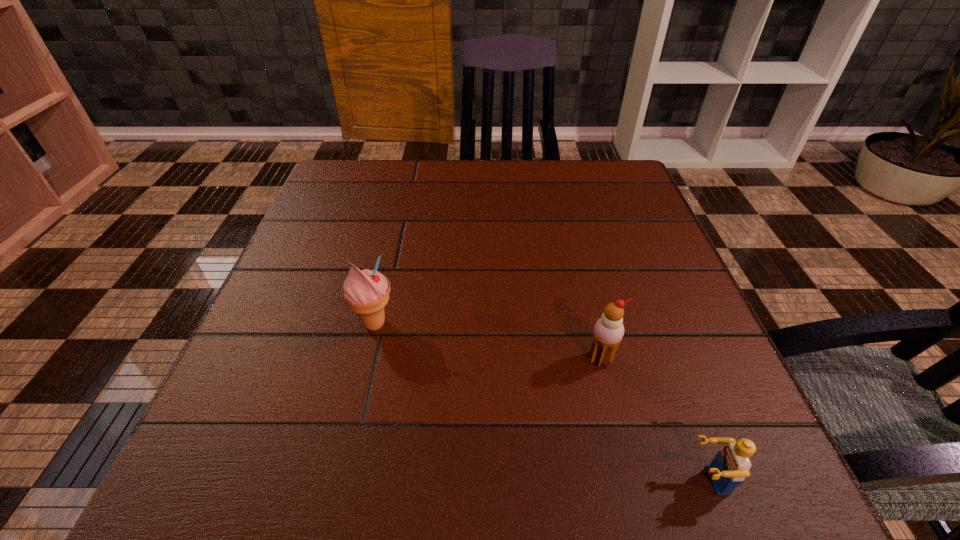
In order to click on vacant region located 0.210m on the face of the shortest object in this screenshot , I will do `click(537, 480)`.

Locate an element on the screen. object at the near edge is located at coordinates (731, 465).

This screenshot has width=960, height=540. I want to click on object situated at the right edge, so click(731, 465).

Identify the location of object at the near right corner. Image resolution: width=960 pixels, height=540 pixels. (731, 465).

At what (x,y) coordinates should I click in order to perform the action: click on vacant region at the far edge of the desktop. Please return your answer as a coordinate pair (x, y). Looking at the image, I should click on (503, 177).

Image resolution: width=960 pixels, height=540 pixels. Identify the location of vacant space at the near edge. (306, 455).

Where is `free spot at the left edge of the desktop`? The height and width of the screenshot is (540, 960). free spot at the left edge of the desktop is located at coordinates (329, 287).

Image resolution: width=960 pixels, height=540 pixels. In order to click on free space at the far left corner in this screenshot , I will do `click(329, 185)`.

At what (x,y) coordinates should I click in order to perform the action: click on blank area at the near left corner. Please return your answer as a coordinate pair (x, y). The width and height of the screenshot is (960, 540). Looking at the image, I should click on (237, 482).

You are a GUI agent. You are given a task and a screenshot of the screen. Output one action in this format:
    pyautogui.click(x=<x>, y=<y>)
    Task: Click on the free spot between the left icecream and the nearer icecream
    This screenshot has height=540, width=960.
    Given the screenshot: What is the action you would take?
    pyautogui.click(x=488, y=341)